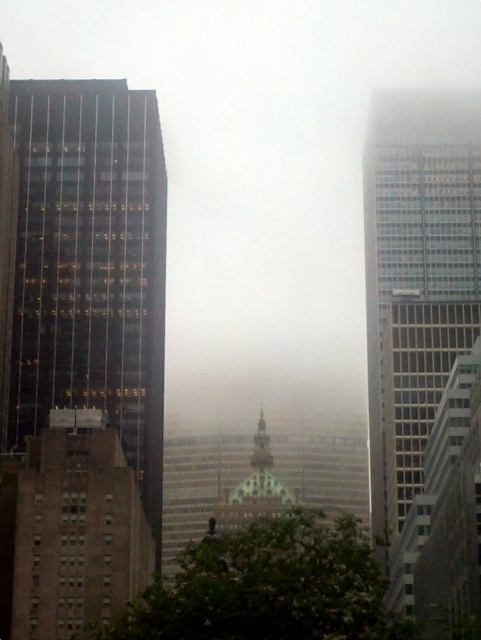
You are standing in the foggy urban scene and want to take a photo of the dark glass skyscraper at left. Considering the distance between you and the skyscraper, can you capture the entire structure in a single frame without moving the camera?

The dark glass skyscraper at left is 460.66 feet away from the viewer. Depending on the camera lens used, capturing the entire structure in one frame may require a wide angle lens to accommodate the building size at that distance. Without knowing the camera specifications, it is uncertain, but the distance itself does not inherently prevent capturing the skyscraper.

You are a city planner assessing building widths for a new project. From your vantage point, you observe the dark glass skyscraper at left and the glassy reflective skyscraper at right. Which of these two buildings appears narrower?

The dark glass skyscraper at left appears narrower than the glassy reflective skyscraper at right because it has a lesser width according to the description.

You are standing at the point marked as point (416, 280) and want to walk towards the glassy reflective skyscraper at right. Is the glassy reflective skyscraper at right in front of or behind you?

The glassy reflective skyscraper at right is located at point (416, 280), so you are already at the location of the glassy reflective skyscraper at right.